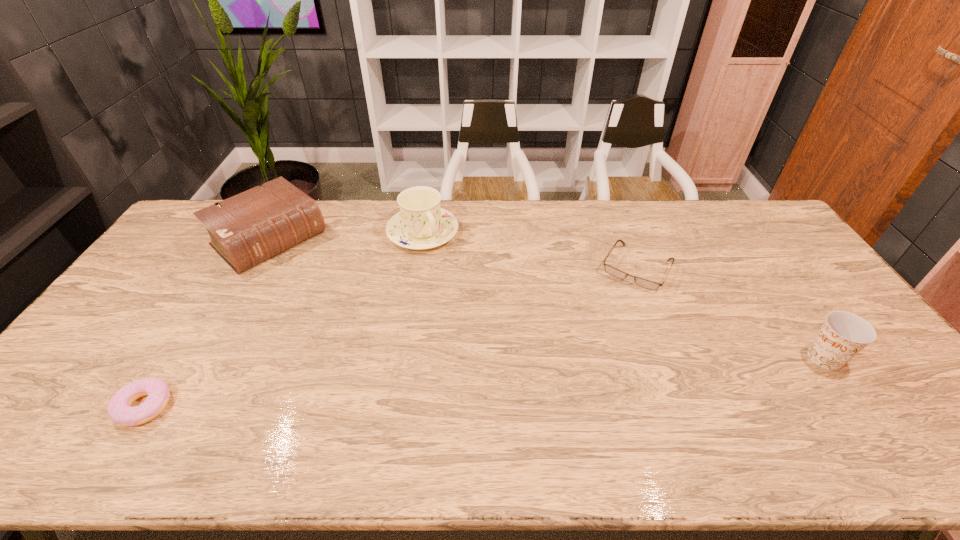
In order to click on the nearest object in this screenshot , I will do `click(119, 409)`.

Locate an element on the screen. This screenshot has width=960, height=540. the fourth farthest object is located at coordinates (843, 335).

Locate an element on the screen. This screenshot has height=540, width=960. the rightmost object is located at coordinates (843, 335).

Identify the location of chinaware. This screenshot has height=540, width=960. (421, 224).

You are a GUI agent. You are given a task and a screenshot of the screen. Output one action in this format:
    pyautogui.click(x=<x>, y=<y>)
    Task: Click on the fourth object from left to right
    The height and width of the screenshot is (540, 960).
    Given the screenshot: What is the action you would take?
    pyautogui.click(x=647, y=284)

Identify the location of Bible. The height and width of the screenshot is (540, 960). (249, 228).

This screenshot has width=960, height=540. Find the location of `vacant space situated on the right of the doughnut`. vacant space situated on the right of the doughnut is located at coordinates (228, 406).

Where is `blank space located on the back of the rightmost object`? This screenshot has height=540, width=960. blank space located on the back of the rightmost object is located at coordinates [x=784, y=300].

Identify the location of vacant area situated 0.220m on the handle side of the third object from right to left. (468, 293).

Locate an element on the screen. Image resolution: width=960 pixels, height=540 pixels. free space located 0.080m on the handle side of the third object from right to left is located at coordinates (447, 266).